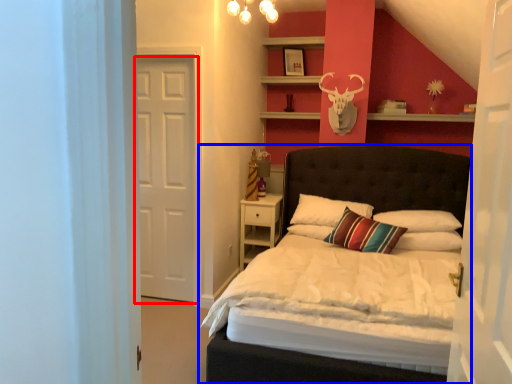
Question: Which object is closer to the camera taking this photo, door (highlighted by a red box) or bed (highlighted by a blue box)?

Choices:
 (A) door
 (B) bed

Answer: (B)